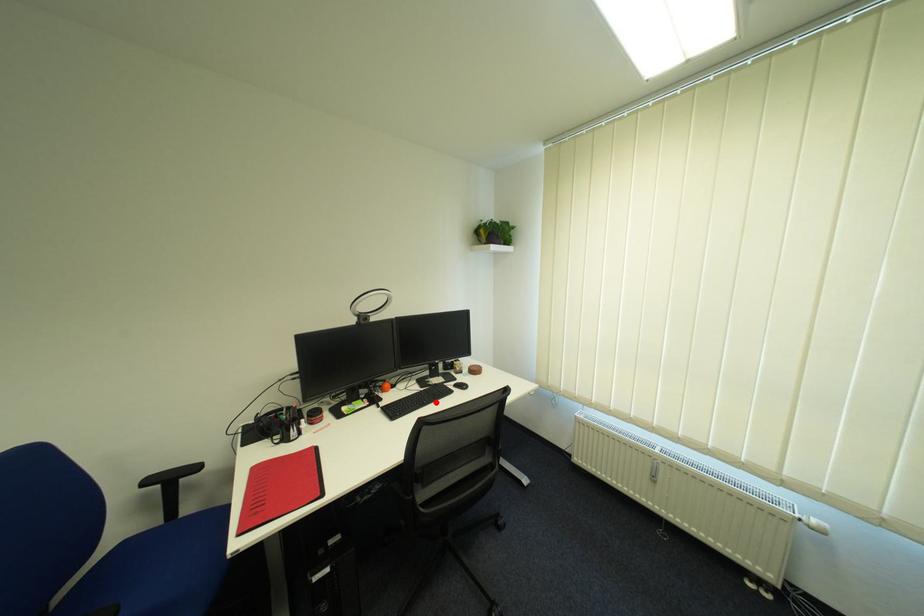
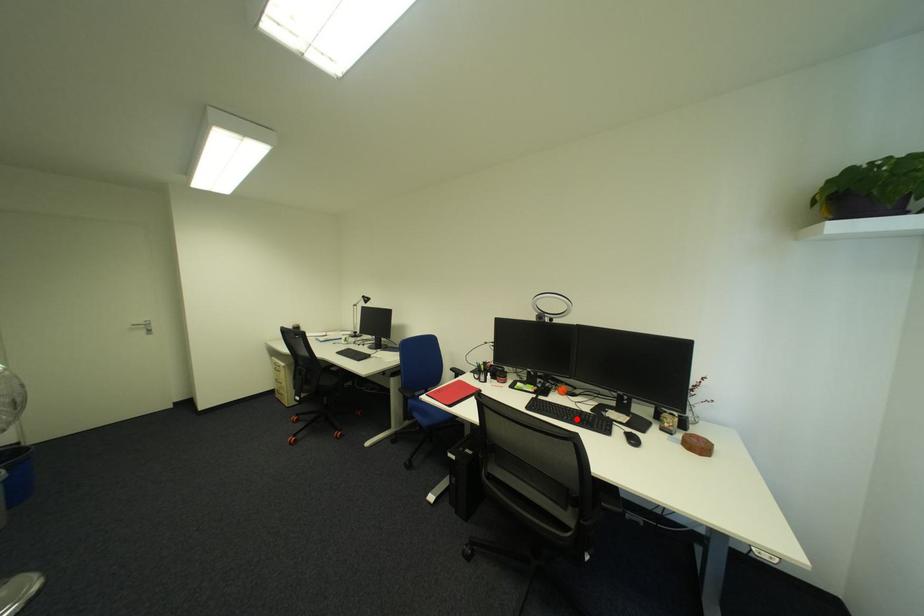
I am providing you with two images of the same scene from different viewpoints. A red point is marked on the first image and another point is marked on the second image. Do the highlighted points in image1 and image2 indicate the same real-world spot?

Yes